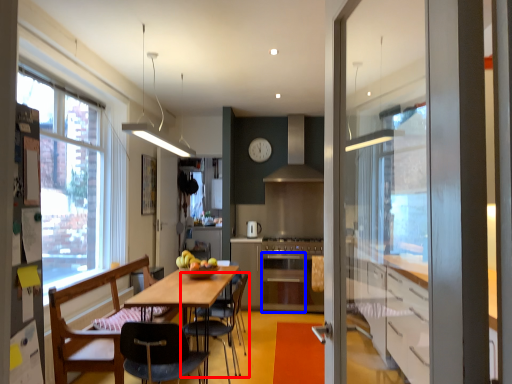
Question: Among these objects, which one is farthest to the camera, chair (highlighted by a red box) or oven (highlighted by a blue box)?

Choices:
 (A) chair
 (B) oven

Answer: (B)